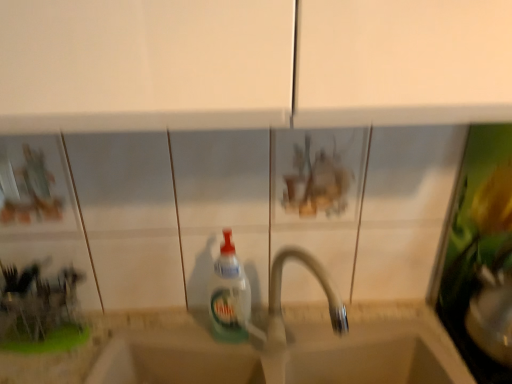
Question: Can you confirm if beige stone sink at center is shorter than translucent plastic bottle at center?

Choices:
 (A) no
 (B) yes

Answer: (A)

Question: Does beige stone sink at center have a greater height compared to translucent plastic bottle at center?

Choices:
 (A) yes
 (B) no

Answer: (A)

Question: From the image's perspective, is beige stone sink at center located beneath translucent plastic bottle at center?

Choices:
 (A) yes
 (B) no

Answer: (A)

Question: Could you tell me if beige stone sink at center is facing translucent plastic bottle at center?

Choices:
 (A) yes
 (B) no

Answer: (B)

Question: Is beige stone sink at center outside of translucent plastic bottle at center?

Choices:
 (A) yes
 (B) no

Answer: (A)

Question: Is point (253, 332) closer or farther from the camera than point (240, 301)?

Choices:
 (A) closer
 (B) farther

Answer: (A)

Question: Is white plastic tap at center in front of or behind translucent plastic bottle at center in the image?

Choices:
 (A) behind
 (B) front

Answer: (B)

Question: Is white plastic tap at center spatially inside translucent plastic bottle at center, or outside of it?

Choices:
 (A) outside
 (B) inside

Answer: (A)

Question: From the image's perspective, relative to translucent plastic bottle at center, is white plastic tap at center above or below?

Choices:
 (A) above
 (B) below

Answer: (B)

Question: From the image's perspective, is white plastic tap at center located above or below beige stone sink at center?

Choices:
 (A) above
 (B) below

Answer: (A)

Question: Considering the positions of white plastic tap at center and beige stone sink at center in the image, is white plastic tap at center taller or shorter than beige stone sink at center?

Choices:
 (A) tall
 (B) short

Answer: (A)

Question: Considering the positions of point (272, 332) and point (402, 340), is point (272, 332) closer or farther from the camera than point (402, 340)?

Choices:
 (A) farther
 (B) closer

Answer: (B)

Question: From a real-world perspective, is white plastic tap at center above or below beige stone sink at center?

Choices:
 (A) above
 (B) below

Answer: (A)

Question: Which is correct: translucent plastic bottle at center is inside beige stone sink at center, or outside of it?

Choices:
 (A) outside
 (B) inside

Answer: (A)

Question: Is point (237, 306) positioned closer to the camera than point (118, 377)?

Choices:
 (A) closer
 (B) farther

Answer: (A)